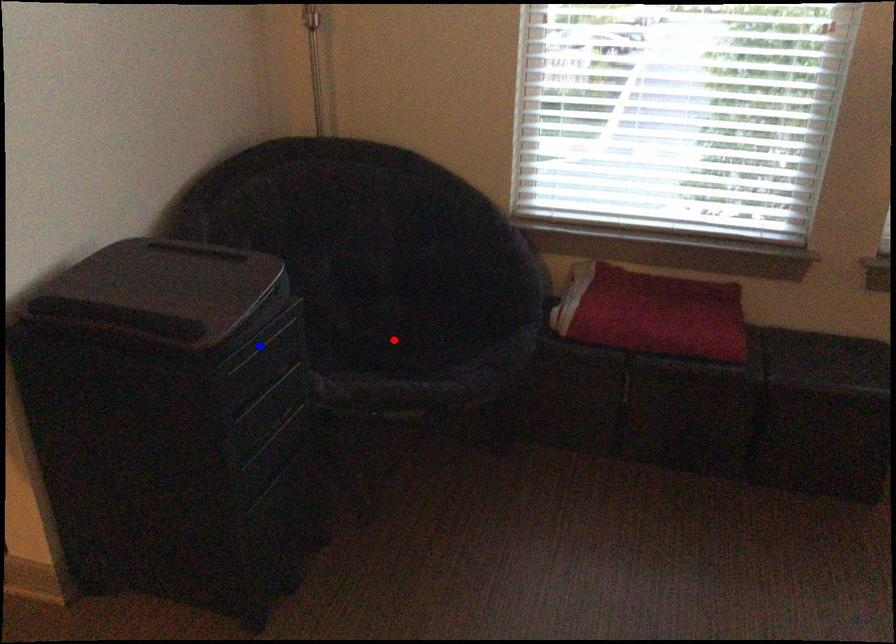
Question: In the image, two points are highlighted. Which point is nearer to the camera? Reply with the corresponding letter.

Choices:
 (A) blue point
 (B) red point

Answer: (A)